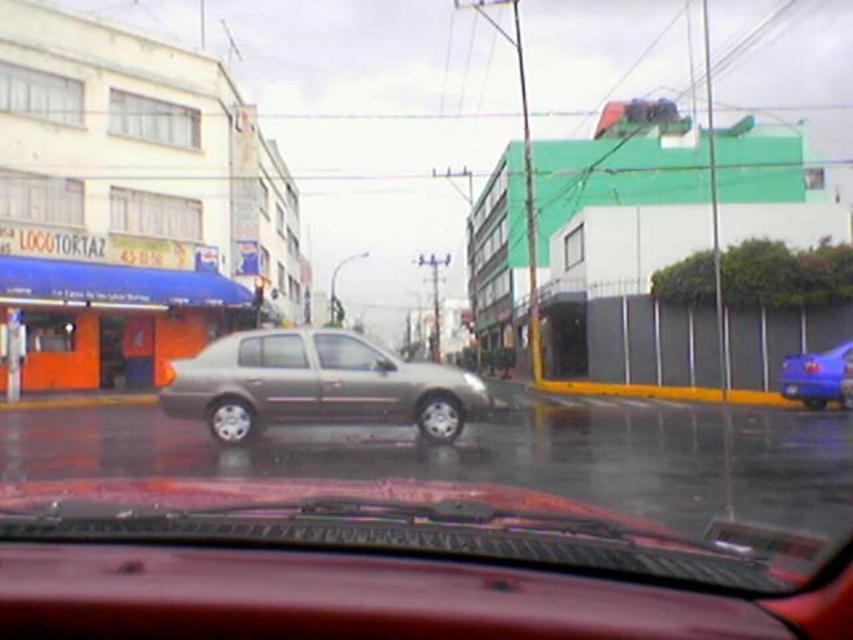
What do you see at coordinates (817, 374) in the screenshot? The height and width of the screenshot is (640, 853). I see `blue metallic van at right` at bounding box center [817, 374].

Is blue metallic van at right behind blue plastic license plate at center?

No, it is in front of blue plastic license plate at center.

Is point (827, 369) farther from viewer compared to point (786, 385)?

No.

The width and height of the screenshot is (853, 640). I want to click on blue metallic van at right, so click(817, 374).

Does satin silver car window at center have a greater height compared to satin silver window at center?

Yes.

Is satin silver car window at center positioned behind satin silver window at center?

Yes, satin silver car window at center is behind satin silver window at center.

Is point (335, 348) positioned after point (248, 352)?

Yes, point (335, 348) is farther from viewer.

What are the coordinates of `satin silver car window at center` in the screenshot? It's located at (349, 353).

Between blue metallic van at right and satin silver window at center, which one has more height?

With more height is blue metallic van at right.

Does point (828, 376) come closer to viewer compared to point (280, 365)?

No, (828, 376) is further to viewer.

I want to click on blue metallic van at right, so click(817, 374).

Locate an element on the screen. This screenshot has width=853, height=640. blue metallic van at right is located at coordinates (817, 374).